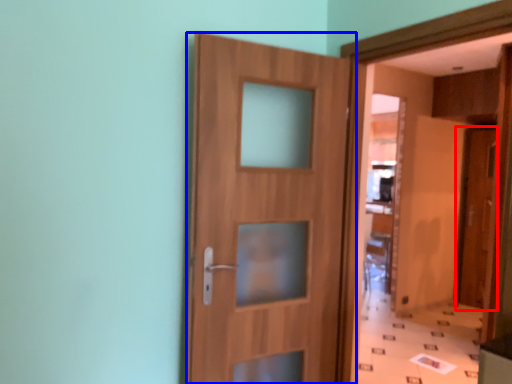
Question: Which object is further to the camera taking this photo, door (highlighted by a red box) or door (highlighted by a blue box)?

Choices:
 (A) door
 (B) door

Answer: (A)